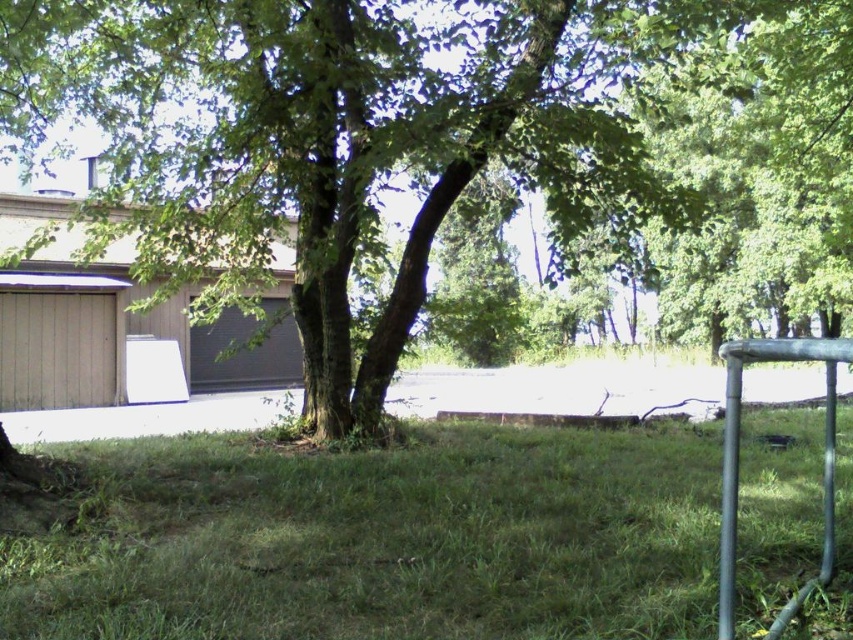
You are a gardener who wants to plant a new flower bed between the green leafy tree at center and the green grassy at center. Considering their heights, which object will cast a shadow over the flower bed during midday?

The green leafy tree at center will cast a shadow over the flower bed during midday because it has a greater height compared to the green grassy at center.

You are planning to install a small garden between the green leafy tree at center and the green grassy at center. Given that the garden requires a minimum of 50 feet of space between the tree and the grass to thrive, will the current distance be sufficient?

The distance between the green leafy tree at center and the green grassy at center is 67.94 feet, which exceeds the required 50 feet. Therefore, the current distance is sufficient for the garden to thrive.

You are a painter wanting to capture the scene. You need to decide which object to paint first based on their heights. Which one should you start with, the green leafy tree at center or the metallic silver rail at lower right?

The green leafy tree at center is taller than the metallic silver rail at lower right, so you should start painting the green leafy tree at center first.